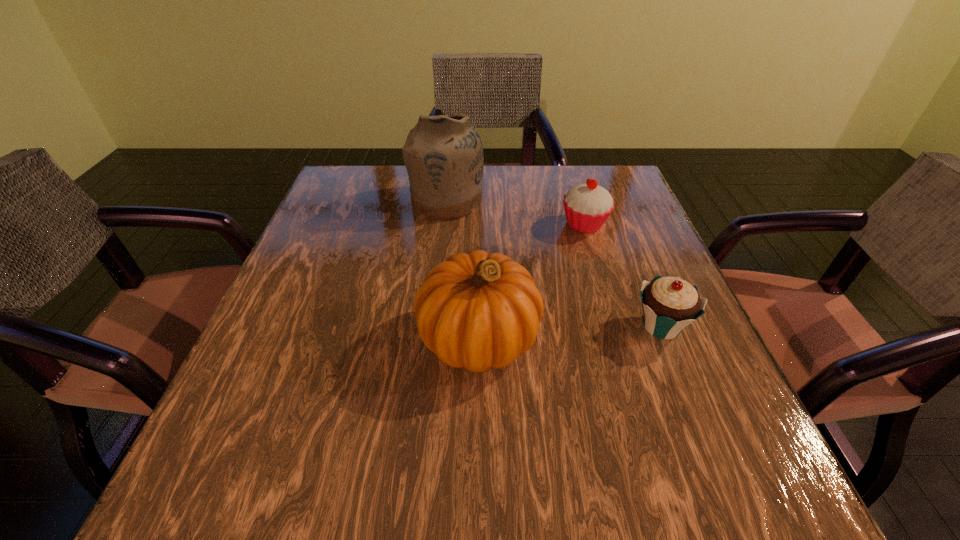
You are a GUI agent. You are given a task and a screenshot of the screen. Output one action in this format:
    pyautogui.click(x=<x>, y=<y>)
    Task: Click on the object located in the far right corner section of the desktop
    
    Given the screenshot: What is the action you would take?
    pyautogui.click(x=587, y=206)

Where is `vacant space at the far edge`? vacant space at the far edge is located at coordinates (548, 168).

In the image, there is a desktop. At what (x,y) coordinates should I click in order to perform the action: click on vacant space at the near edge. Please return your answer as a coordinate pair (x, y). The height and width of the screenshot is (540, 960). Looking at the image, I should click on (617, 476).

In order to click on vacant space at the left edge of the desktop in this screenshot , I will do `click(335, 230)`.

Locate an element on the screen. This screenshot has width=960, height=540. blank space at the right edge is located at coordinates (640, 286).

In the image, there is a desktop. Where is `free space at the far left corner`? The image size is (960, 540). free space at the far left corner is located at coordinates (374, 168).

Where is `blank space at the near left corner of the desktop`? The image size is (960, 540). blank space at the near left corner of the desktop is located at coordinates (258, 453).

Where is `empty location between the tallest object and the nearer cupcake`? The width and height of the screenshot is (960, 540). empty location between the tallest object and the nearer cupcake is located at coordinates (554, 264).

The width and height of the screenshot is (960, 540). Identify the location of empty space that is in between the nearer cupcake and the third shortest object. (570, 332).

Where is `free area in between the nearer cupcake and the tallest object`? free area in between the nearer cupcake and the tallest object is located at coordinates (554, 264).